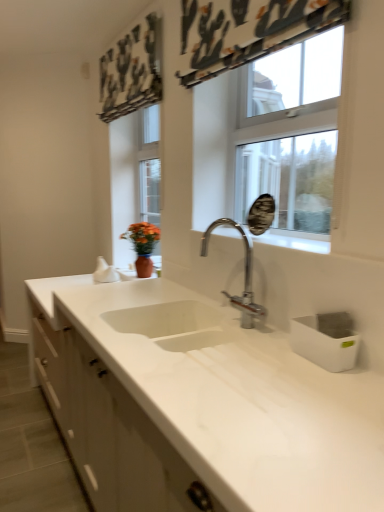
This screenshot has width=384, height=512. In order to click on clear glass window at upper center in this screenshot , I will do [272, 141].

Describe the element at coordinates (272, 141) in the screenshot. I see `clear glass window at upper center` at that location.

What do you see at coordinates (245, 276) in the screenshot?
I see `chrome metallic faucet at center` at bounding box center [245, 276].

Where is `chrome metallic faucet at center`? The width and height of the screenshot is (384, 512). chrome metallic faucet at center is located at coordinates (245, 276).

Measure the distance between chrome metallic faucet at center and camera.

chrome metallic faucet at center is 1.57 meters from camera.

Where is `clear glass window at upper center`? The width and height of the screenshot is (384, 512). clear glass window at upper center is located at coordinates (272, 141).

Is clear glass window at upper center to the left of chrome metallic faucet at center from the viewer's perspective?

In fact, clear glass window at upper center is to the right of chrome metallic faucet at center.

Which object is closer to the camera taking this photo, clear glass window at upper center or chrome metallic faucet at center?

chrome metallic faucet at center is more forward.

Is point (300, 238) more distant than point (235, 307)?

No, it is in front of (235, 307).

From the image's perspective, is clear glass window at upper center beneath chrome metallic faucet at center?

No.

From a real-world perspective, is clear glass window at upper center above or below chrome metallic faucet at center?

clear glass window at upper center is above chrome metallic faucet at center.

Between clear glass window at upper center and chrome metallic faucet at center, which one has larger width?

A: chrome metallic faucet at center.

Considering the sizes of clear glass window at upper center and chrome metallic faucet at center in the image, is clear glass window at upper center taller or shorter than chrome metallic faucet at center?

Clearly, clear glass window at upper center is taller compared to chrome metallic faucet at center.

Between clear glass window at upper center and chrome metallic faucet at center, which one has larger size?

With larger size is clear glass window at upper center.

Do you think clear glass window at upper center is within chrome metallic faucet at center, or outside of it?

clear glass window at upper center cannot be found inside chrome metallic faucet at center.

Are clear glass window at upper center and chrome metallic faucet at center located far from each other?

No, there isn't a large distance between clear glass window at upper center and chrome metallic faucet at center.

Does clear glass window at upper center turn towards chrome metallic faucet at center?

Yes, clear glass window at upper center is facing chrome metallic faucet at center.

In the scene shown: How different are the orientations of clear glass window at upper center and chrome metallic faucet at center in degrees?

The angle between the facing direction of clear glass window at upper center and the facing direction of chrome metallic faucet at center is 3.63 degrees.

How far apart are clear glass window at upper center and chrome metallic faucet at center?

clear glass window at upper center and chrome metallic faucet at center are 16.65 inches apart.

I want to click on tap beneath the clear glass window at upper center (from a real-world perspective), so click(245, 276).

Would you say chrome metallic faucet at center is to the left or to the right of clear glass window at upper center in the picture?

In the image, chrome metallic faucet at center appears on the left side of clear glass window at upper center.

Is chrome metallic faucet at center closer to the viewer compared to clear glass window at upper center?

Yes, chrome metallic faucet at center is closer to the viewer.

Is point (250, 297) farther from viewer compared to point (235, 97)?

No, it is not.

From the image's perspective, between chrome metallic faucet at center and clear glass window at upper center, who is located below?

chrome metallic faucet at center, from the image's perspective.

From a real-world perspective, is chrome metallic faucet at center positioned above or below clear glass window at upper center?

chrome metallic faucet at center is situated lower than clear glass window at upper center in the real world.

Considering the relative sizes of chrome metallic faucet at center and clear glass window at upper center in the image provided, is chrome metallic faucet at center thinner than clear glass window at upper center?

Incorrect, the width of chrome metallic faucet at center is not less than that of clear glass window at upper center.

Between chrome metallic faucet at center and clear glass window at upper center, which one has less height?

Standing shorter between the two is chrome metallic faucet at center.

Is chrome metallic faucet at center bigger or smaller than clear glass window at upper center?

Clearly, chrome metallic faucet at center is smaller in size than clear glass window at upper center.

Can we say chrome metallic faucet at center lies outside clear glass window at upper center?

Yes, chrome metallic faucet at center is not within clear glass window at upper center.

Can you see chrome metallic faucet at center touching clear glass window at upper center?

No, chrome metallic faucet at center is not making contact with clear glass window at upper center.

Is chrome metallic faucet at center facing towards clear glass window at upper center?

No, chrome metallic faucet at center is not facing towards clear glass window at upper center.

What's the angular difference between chrome metallic faucet at center and clear glass window at upper center's facing directions?

3.63 degrees separate the facing orientations of chrome metallic faucet at center and clear glass window at upper center.

Locate an element on the screen. window that is on the right side of chrome metallic faucet at center is located at coordinates (272, 141).

Where is `tap in front of the clear glass window at upper center`? This screenshot has width=384, height=512. tap in front of the clear glass window at upper center is located at coordinates (245, 276).

The height and width of the screenshot is (512, 384). In order to click on window located behind the chrome metallic faucet at center in this screenshot , I will do `click(272, 141)`.